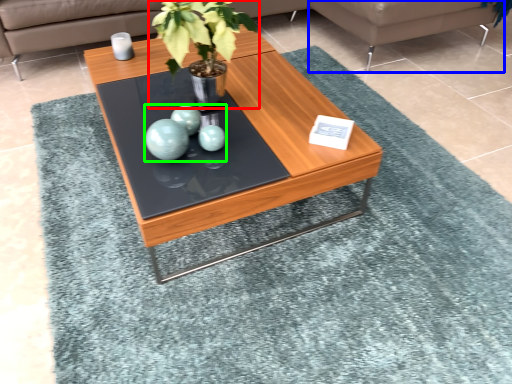
Question: Which object is the farthest from houseplant (highlighted by a red box)? Choose among these: couch (highlighted by a blue box) or teal (highlighted by a green box).

Choices:
 (A) couch
 (B) teal

Answer: (A)